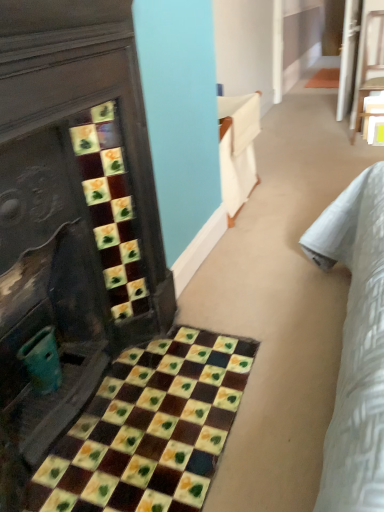
Locate an element on the screen. teal plastic cup at lower left is located at coordinates (42, 361).

I want to click on yellow matte square at center, so click(x=375, y=130).

At what (x,y) coordinates should I click in order to perform the action: click on furniture behind the teal plastic cup at lower left. Please return your answer as a coordinate pair (x, y). The image size is (384, 512). Looking at the image, I should click on (370, 63).

In terms of width, does teal plastic cup at lower left look wider or thinner when compared to wooden chair at upper right?

Clearly, teal plastic cup at lower left has less width compared to wooden chair at upper right.

Could you tell me if teal plastic cup at lower left is turned towards wooden chair at upper right?

No.

Which of these two, teal plastic cup at lower left or wooden chair at upper right, stands taller?

Standing taller between the two is wooden chair at upper right.

Considering the relative positions of yellow matte square at center and teal plastic cup at lower left in the image provided, is yellow matte square at center to the right of teal plastic cup at lower left from the viewer's perspective?

Yes.

Is yellow matte square at center directly adjacent to teal plastic cup at lower left?

No, yellow matte square at center is not making contact with teal plastic cup at lower left.

From a real-world perspective, is yellow matte square at center located higher than teal plastic cup at lower left?

No, from a real-world perspective, yellow matte square at center is not above teal plastic cup at lower left.

Is yellow matte square at center shorter than teal plastic cup at lower left?

Yes, yellow matte square at center is shorter than teal plastic cup at lower left.

This screenshot has width=384, height=512. What are the coordinates of `furniture that is on the left side of yellow matte square at center` in the screenshot? It's located at (370, 63).

Is yellow matte square at center not close to wooden chair at upper right?

No, there isn't a large distance between yellow matte square at center and wooden chair at upper right.

Is multicolored mosaic tiles at lower left bigger or smaller than teal plastic cup at lower left?

In the image, multicolored mosaic tiles at lower left appears to be larger than teal plastic cup at lower left.

Considering the positions of objects multicolored mosaic tiles at lower left and teal plastic cup at lower left in the image provided, who is more to the right, multicolored mosaic tiles at lower left or teal plastic cup at lower left?

multicolored mosaic tiles at lower left.

Could you tell me if multicolored mosaic tiles at lower left is facing teal plastic cup at lower left?

No, multicolored mosaic tiles at lower left is not turned towards teal plastic cup at lower left.

Identify the location of teal on the left of multicolored mosaic tiles at lower left. (42, 361).

Is point (35, 342) positioned after point (216, 426)?

No, it is in front of (216, 426).

Based on the photo, does teal plastic cup at lower left have a lesser height compared to multicolored mosaic tiles at lower left?

Incorrect, the height of teal plastic cup at lower left does not fall short of that of multicolored mosaic tiles at lower left.

Based on their sizes in the image, would you say teal plastic cup at lower left is bigger or smaller than multicolored mosaic tiles at lower left?

Clearly, teal plastic cup at lower left is smaller in size than multicolored mosaic tiles at lower left.

In the scene shown: Can you tell me how much yellow matte square at center and multicolored mosaic tiles at lower left differ in facing direction?

yellow matte square at center and multicolored mosaic tiles at lower left are facing 89 degrees away from each other.

From the image's perspective, is yellow matte square at center located above or below multicolored mosaic tiles at lower left?

yellow matte square at center is situated higher than multicolored mosaic tiles at lower left in the image.

From the picture: Between yellow matte square at center and multicolored mosaic tiles at lower left, which one is positioned behind?

yellow matte square at center.

Is multicolored mosaic tiles at lower left turned away from wooden chair at upper right?

No.

How much distance is there between multicolored mosaic tiles at lower left and wooden chair at upper right?

multicolored mosaic tiles at lower left and wooden chair at upper right are 10.20 feet apart.

In the image, is multicolored mosaic tiles at lower left positioned in front of or behind wooden chair at upper right?

Visually, multicolored mosaic tiles at lower left is located in front of wooden chair at upper right.

How many degrees apart are the facing directions of multicolored mosaic tiles at lower left and wooden chair at upper right?

There is a 89-degree angle between the facing directions of multicolored mosaic tiles at lower left and wooden chair at upper right.

Locate an element on the screen. teal on the left of wooden chair at upper right is located at coordinates (42, 361).

Locate an element on the screen. This screenshot has height=512, width=384. square lying above the teal plastic cup at lower left (from the image's perspective) is located at coordinates (375, 130).

Estimate the real-world distances between objects in this image. Which object is further from yellow matte square at center, wooden chair at upper right or multicolored mosaic tiles at lower left?

multicolored mosaic tiles at lower left lies further to yellow matte square at center than the other object.

When comparing their distances from yellow matte square at center, does teal plastic cup at lower left or multicolored mosaic tiles at lower left seem further?

teal plastic cup at lower left is further to yellow matte square at center.

Consider the image. Which object lies nearer to the anchor point multicolored mosaic tiles at lower left, yellow matte square at center or wooden chair at upper right?

Based on the image, yellow matte square at center appears to be nearer to multicolored mosaic tiles at lower left.

Which object lies further to the anchor point wooden chair at upper right, multicolored mosaic tiles at lower left or teal plastic cup at lower left?

teal plastic cup at lower left is positioned further to the anchor wooden chair at upper right.

From the image, which object appears to be nearer to teal plastic cup at lower left, yellow matte square at center or wooden chair at upper right?

yellow matte square at center.

Considering their positions, is multicolored mosaic tiles at lower left positioned closer to yellow matte square at center than teal plastic cup at lower left?

multicolored mosaic tiles at lower left.

Based on their spatial positions, is teal plastic cup at lower left or yellow matte square at center closer to multicolored mosaic tiles at lower left?

teal plastic cup at lower left.

Considering their positions, is teal plastic cup at lower left positioned closer to wooden chair at upper right than multicolored mosaic tiles at lower left?

multicolored mosaic tiles at lower left is closer to wooden chair at upper right.

Locate an element on the screen. The height and width of the screenshot is (512, 384). furniture between multicolored mosaic tiles at lower left and yellow matte square at center in the front-back direction is located at coordinates (370, 63).

This screenshot has width=384, height=512. Identify the location of teal between multicolored mosaic tiles at lower left and yellow matte square at center in the front-back direction. (42, 361).

Where is `teal between multicolored mosaic tiles at lower left and wooden chair at upper right in the front-back direction`? The height and width of the screenshot is (512, 384). teal between multicolored mosaic tiles at lower left and wooden chair at upper right in the front-back direction is located at coordinates (42, 361).

Image resolution: width=384 pixels, height=512 pixels. I want to click on furniture between teal plastic cup at lower left and yellow matte square at center along the z-axis, so click(x=370, y=63).